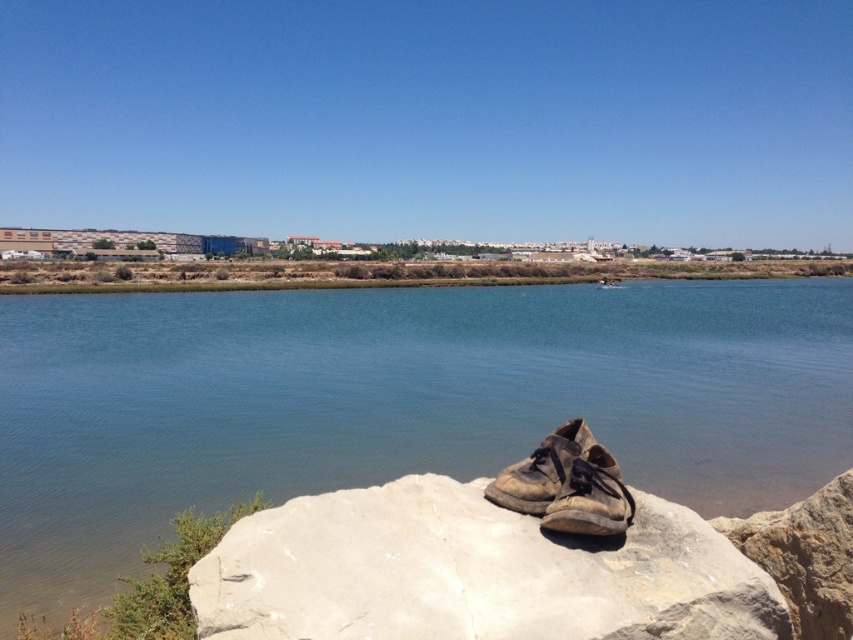
Question: Where is blue water at center located in relation to worn leather shoe at center in the image?

Choices:
 (A) left
 (B) right

Answer: (A)

Question: Is blue water at center further to camera compared to worn leather shoe at center?

Choices:
 (A) yes
 (B) no

Answer: (A)

Question: Does blue water at center appear over smooth gray rock at center?

Choices:
 (A) yes
 (B) no

Answer: (A)

Question: Which point is farther to the camera?

Choices:
 (A) smooth gray rock at center
 (B) worn leather shoe at center

Answer: (B)

Question: Which object is closer to the camera taking this photo?

Choices:
 (A) worn leather shoe at center
 (B) smooth gray rock at center
 (C) blue water at center

Answer: (B)

Question: Which point is farther to the camera?

Choices:
 (A) worn leather shoe at center
 (B) smooth gray rock at center

Answer: (A)